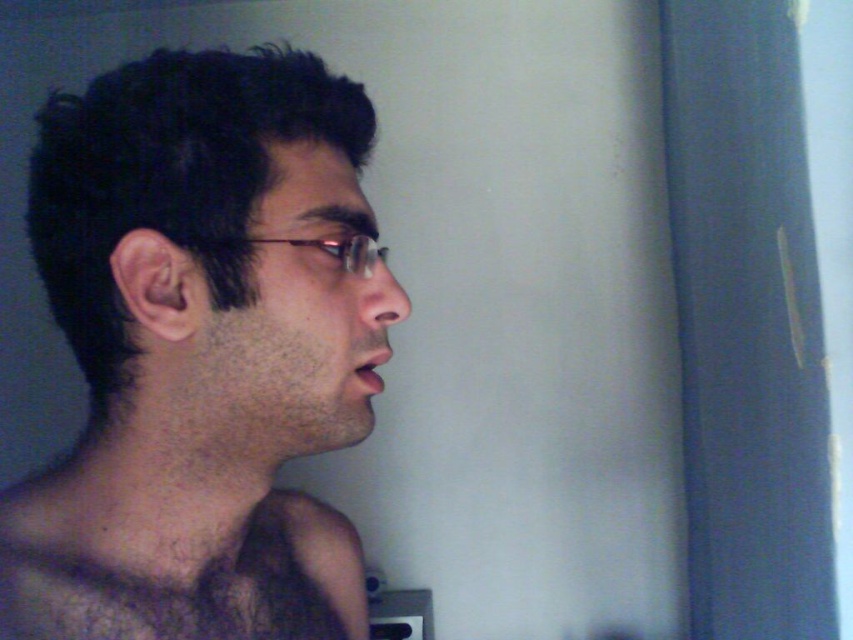
Image resolution: width=853 pixels, height=640 pixels. What do you see at coordinates (202, 352) in the screenshot? I see `dark brown hair at upper left` at bounding box center [202, 352].

From the picture: Between dark brown hair at upper left and dark brown hairy muscle at center, which one is positioned lower?

dark brown hairy muscle at center

Measure the distance between dark brown hair at upper left and camera.

A distance of 15.96 inches exists between dark brown hair at upper left and camera.

Find the location of a particular element. This screenshot has height=640, width=853. dark brown hair at upper left is located at coordinates (202, 352).